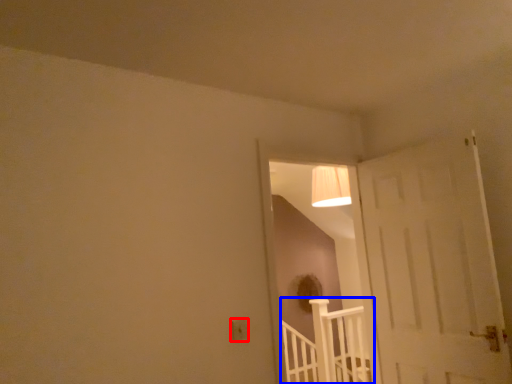
Question: Which of the following is the closest to the observer, electric outlet (highlighted by a red box) or rail (highlighted by a blue box)?

Choices:
 (A) electric outlet
 (B) rail

Answer: (A)